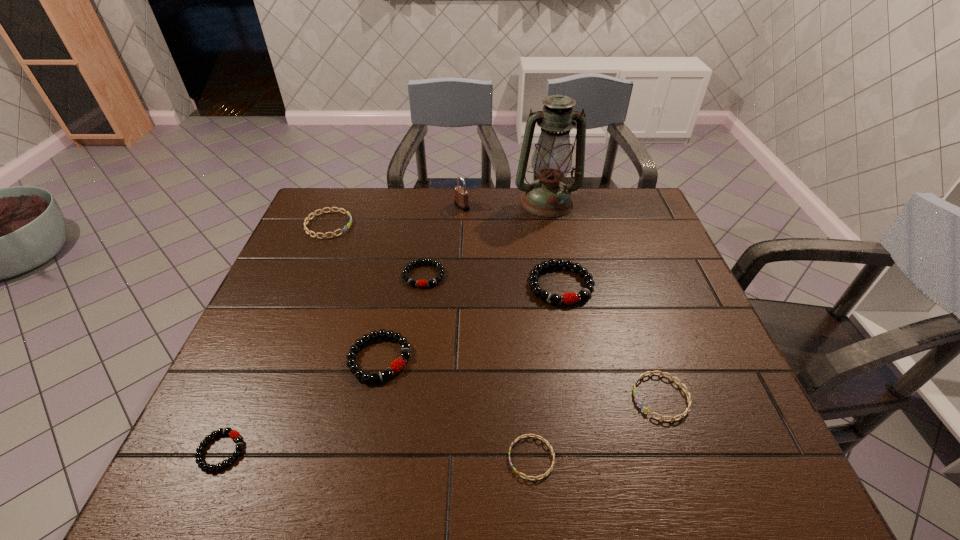
Find the location of a particular element. free region located 0.270m on the left of the second smallest black bracelet is located at coordinates (305, 275).

Image resolution: width=960 pixels, height=540 pixels. Identify the location of vacant space located on the surface of the second farthest blue bracelet showing star-shaped elements. (559, 397).

The width and height of the screenshot is (960, 540). Identify the location of blank space located 0.390m on the surface of the second farthest blue bracelet showing star-shaped elements. (452, 397).

The width and height of the screenshot is (960, 540). Identify the location of vacant space located on the surface of the second farthest blue bracelet showing star-shaped elements. (564, 397).

Find the location of a particular element. free space located on the back of the smallest black bracelet is located at coordinates [x=248, y=391].

I want to click on vacant area situated 0.270m on the surface of the second blue bracelet from right to left showing star-shaped elements, so click(369, 458).

This screenshot has width=960, height=540. I want to click on vacant space located 0.090m on the surface of the second blue bracelet from right to left showing star-shaped elements, so click(462, 458).

Where is `vacant position located on the surface of the second blue bracelet from right to left showing star-shaped elements`? The height and width of the screenshot is (540, 960). vacant position located on the surface of the second blue bracelet from right to left showing star-shaped elements is located at coordinates (x=318, y=458).

Locate an element on the screen. The image size is (960, 540). oil lamp at the far edge is located at coordinates (548, 197).

This screenshot has width=960, height=540. I want to click on padlock present at the far edge, so click(x=461, y=195).